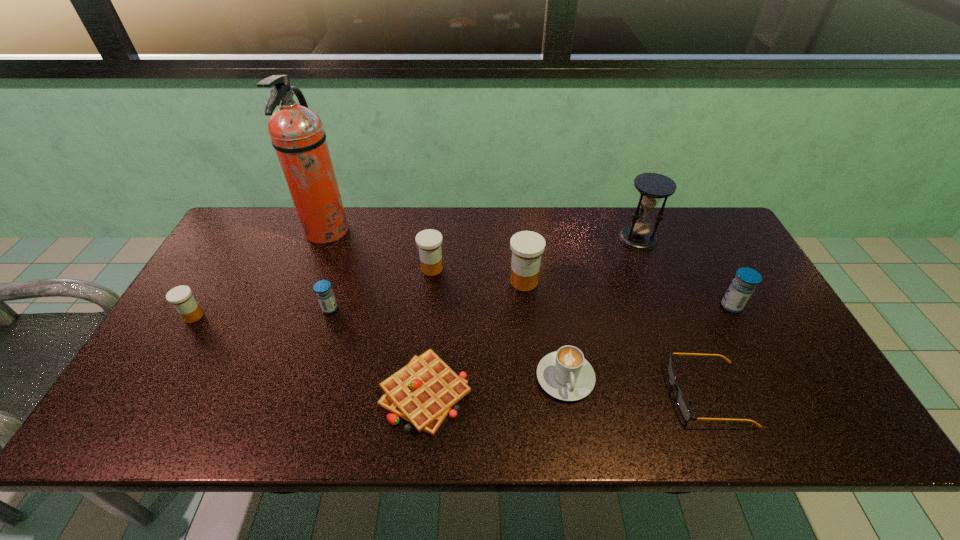
What are the coordinates of `vacant region at the right edge of the desktop` in the screenshot? It's located at (791, 380).

What are the coordinates of `vacant space at the near left corner` in the screenshot? It's located at (127, 434).

This screenshot has height=540, width=960. In the image, there is a desktop. What are the coordinates of `vacant space at the far right corner` in the screenshot? It's located at (714, 218).

The image size is (960, 540). What are the coordinates of `vacant space at the near right corner of the desktop` in the screenshot? It's located at (829, 412).

Where is `free area in between the black hourglass and the fire extinguisher`? This screenshot has height=540, width=960. free area in between the black hourglass and the fire extinguisher is located at coordinates click(x=482, y=235).

Where is `vacant point located between the cappuccino and the second medicine from left to right`? Image resolution: width=960 pixels, height=540 pixels. vacant point located between the cappuccino and the second medicine from left to right is located at coordinates (447, 343).

You are a GUI agent. You are given a task and a screenshot of the screen. Output one action in this format:
    pyautogui.click(x=<x>, y=<y>)
    Task: Click on the unoccupied position between the cappuccino and the second smallest orange medicine
    The width and height of the screenshot is (960, 540).
    Given the screenshot: What is the action you would take?
    pyautogui.click(x=498, y=323)

The height and width of the screenshot is (540, 960). What are the coordinates of `free space between the rightmost orange medicine and the spectacles` in the screenshot? It's located at (616, 338).

Locate an element on the screen. free space between the spectacles and the right blue medicine is located at coordinates (720, 350).

Locate an element on the screen. The height and width of the screenshot is (540, 960). vacant area that lies between the waffle and the black hourglass is located at coordinates click(532, 316).